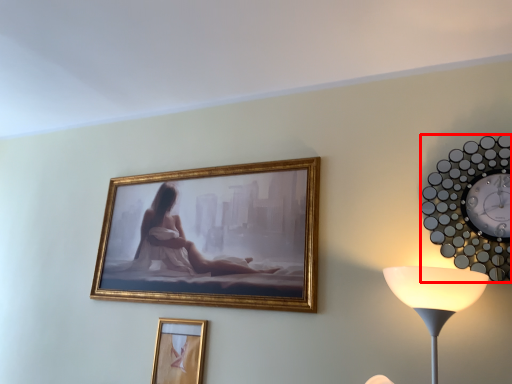
Question: Considering the relative positions of wall clock (annotated by the red box) and picture frame in the image provided, where is wall clock (annotated by the red box) located with respect to the staircase?

Choices:
 (A) right
 (B) left

Answer: (A)